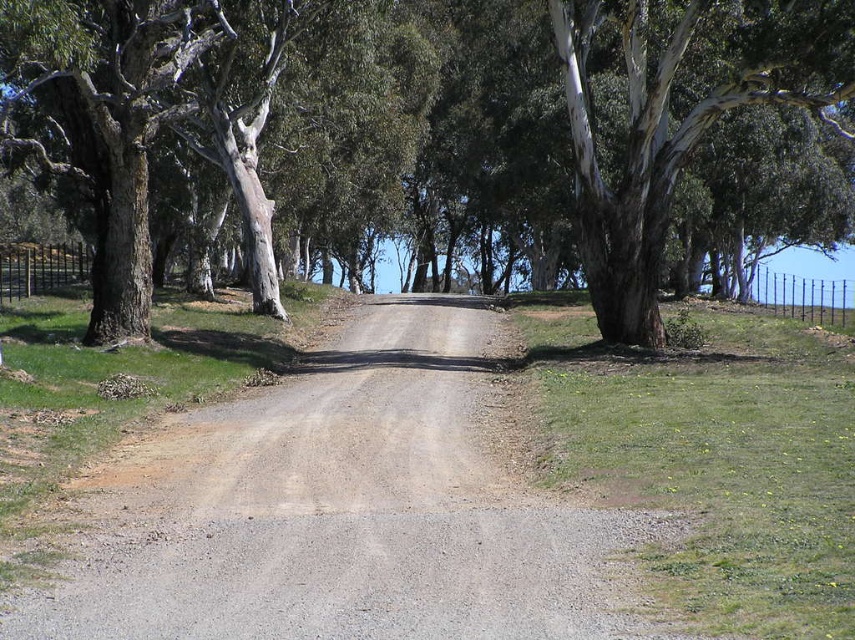
You are standing on the gray gravel road at center and want to walk to the white bark tree at center. Is the tree wider than the road at this point?

The white bark tree at center might be wider than gray gravel road at center, so it is possible that the tree is wider than the road at this point.

You are standing on the dirt road in the rural scene. There is a white bark tree at center marked by point (413, 125). If you walk straight ahead along the road, will you eventually reach the tree?

The white bark tree at center is represented by point (413, 125), so walking straight ahead along the dirt road will lead you directly to the tree as it is positioned along the path.

You are standing at the edge of the gray gravel road at center and looking towards the white bark tree at center. Which object is closer to you?

The white bark tree at center is closer to you because the gray gravel road at center is behind it.